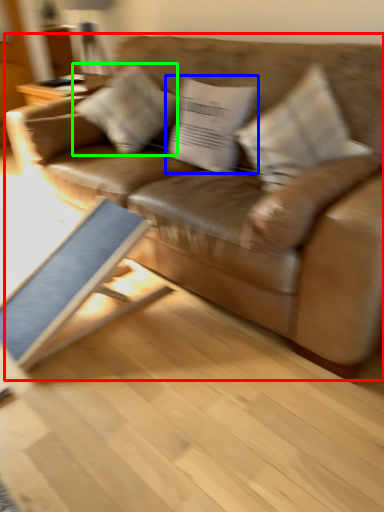
Question: Estimate the real-world distances between objects in this image. Which object is closer to studio couch (highlighted by a red box), pillow (highlighted by a blue box) or pillow (highlighted by a green box)?

Choices:
 (A) pillow
 (B) pillow

Answer: (A)